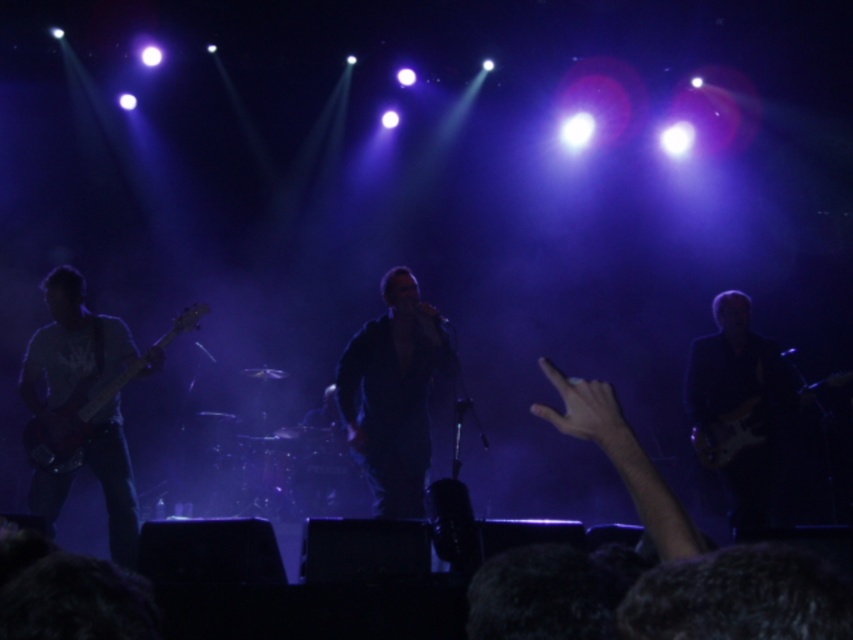
You are a stagehand who needs to place a new microphone stand between the matte white guitar at left and the black matte guitar at right. Considering their heights, which guitar should the stand be closer to?

The matte white guitar at left is taller than the black matte guitar at right, so the microphone stand should be placed closer to the black matte guitar at right to ensure it is within reach of the performer.

Consider the image. You are a photographer at the back of the venue trying to capture a clear shot of both the matte black guitar at left and the matte black electric guitar at right. Based on their positions, which guitar will appear closer to the front in your photo?

The matte black guitar at left appears closer to the front in the photo because it is positioned in front of the matte black electric guitar at right on stage.

You are a stagehand who needs to adjust the lighting for the bass guitarist holding the matte white guitar at left and the electric guitarist holding the black matte guitar at right. Since the stage is divided into three sections, left, center, and right, which guitarist is closer to the left side of the stage?

The matte white guitar at left is positioned to the left of the black matte guitar at right, so the bass guitarist holding the matte white guitar at left is closer to the left side of the stage.